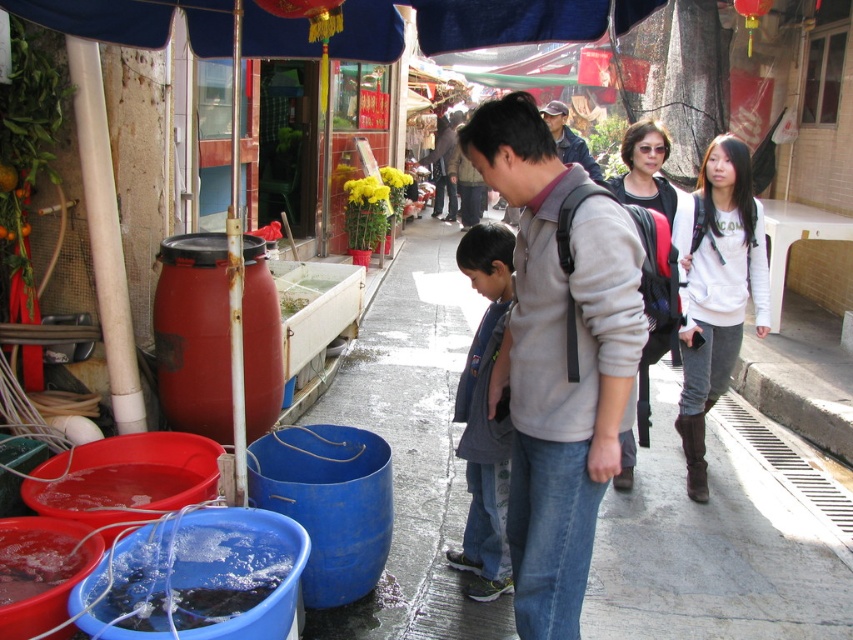
You are a delivery person who needs to place a large package on the smooth concrete sidewalk at center without blocking the denim jacket at center. Is there enough space?

The smooth concrete sidewalk at center has a smaller size compared to the denim jacket at center, so there might not be enough space to place a large package without blocking the denim jacket at center.

You are standing at the origin point of the image coordinate system. You want to walk to the smooth concrete sidewalk at center. Which direction should you go?

The smooth concrete sidewalk at center is located at coordinate point [711,550], so you should move towards the right and downward direction from your current position at the origin.